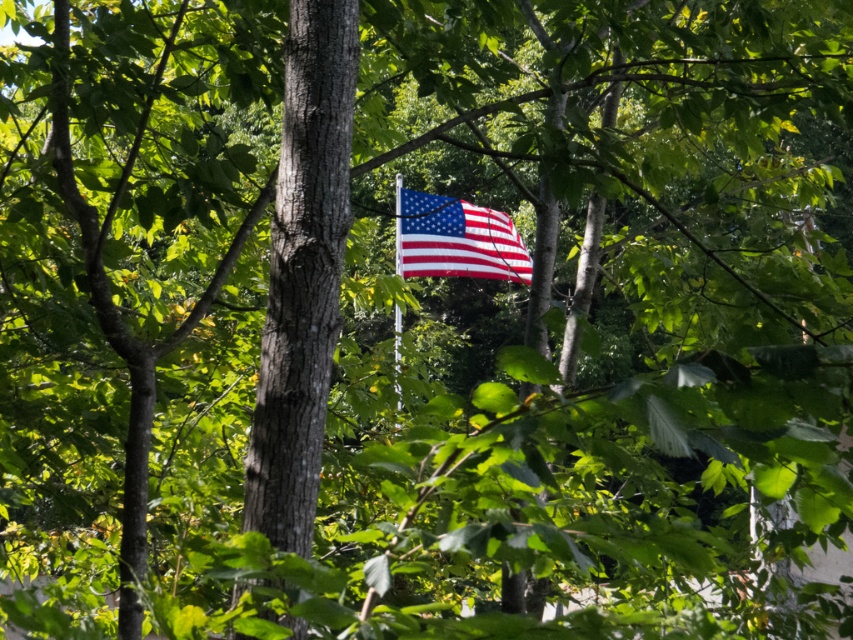
Between polished cotton flag at center and metallic silver flag pole at center, which one appears on the left side from the viewer's perspective?

Positioned to the left is metallic silver flag pole at center.

What do you see at coordinates (456, 237) in the screenshot? The width and height of the screenshot is (853, 640). I see `polished cotton flag at center` at bounding box center [456, 237].

Which is in front, point (454, 253) or point (396, 260)?

Point (454, 253) is in front.

This screenshot has width=853, height=640. In order to click on polished cotton flag at center in this screenshot , I will do `click(456, 237)`.